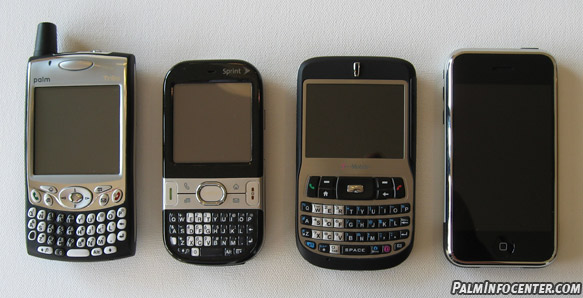
Where is `full "qwerty" keyboards`? This screenshot has height=298, width=583. full "qwerty" keyboards is located at coordinates (359, 223), (209, 228), (71, 228).